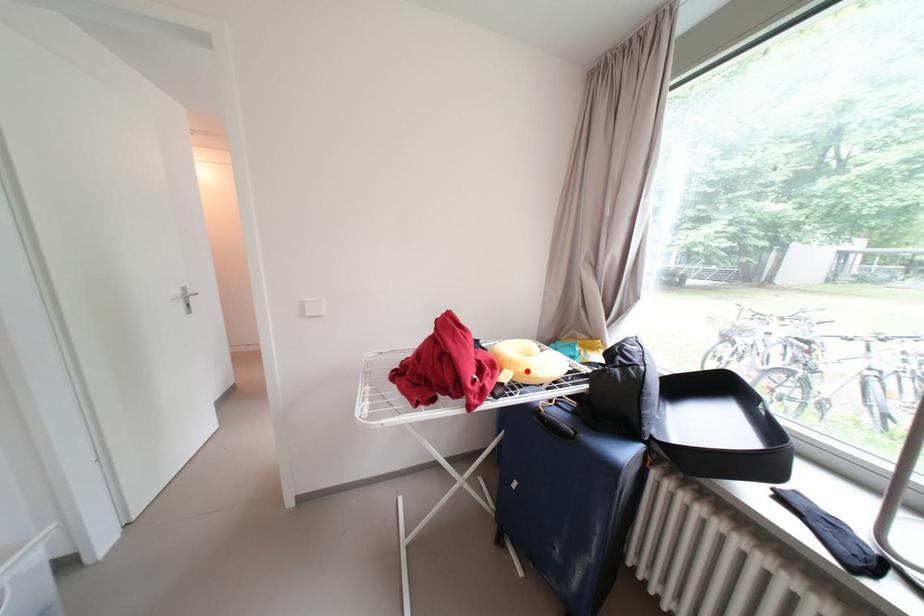
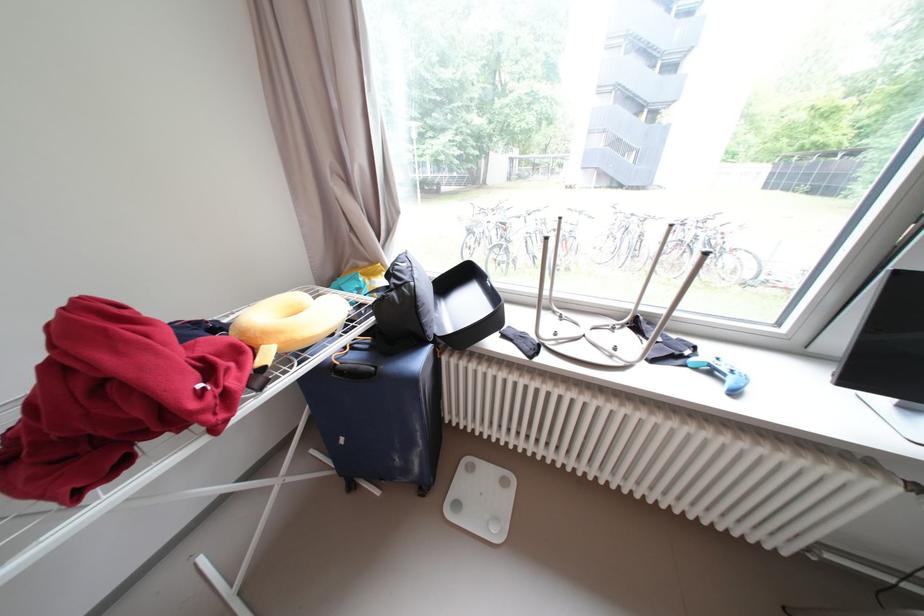
Find the pixel in the second image that matches the highlighted location in the first image.

(290, 339)